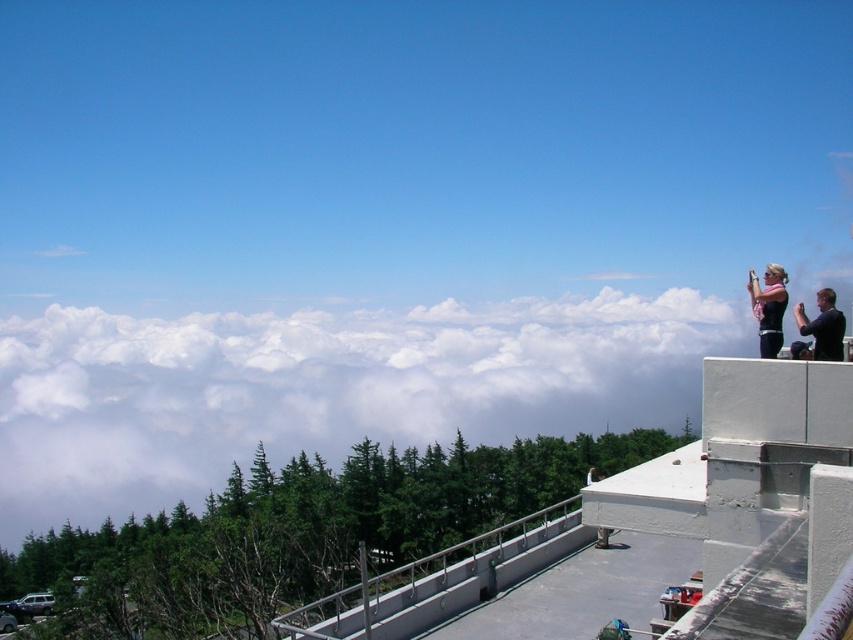
Question: Which is nearer to the pink fabric at upper right?

Choices:
 (A) white fluffy cloud at upper center
 (B) black matte shirt at upper right
 (C) satin silver railing at center
 (D) dark hair person at upper right

Answer: (B)

Question: Which of the following is the closest to the observer?

Choices:
 (A) (763, 310)
 (B) (67, 346)
 (C) (433, 625)
 (D) (596, 474)

Answer: (A)

Question: Is black matte shirt at upper right bigger than dark hair person at upper right?

Choices:
 (A) no
 (B) yes

Answer: (A)

Question: Does pink fabric at upper right appear under black matte shirt at upper right?

Choices:
 (A) no
 (B) yes

Answer: (A)

Question: Can you confirm if white fluffy cloud at upper center is smaller than satin silver railing at center?

Choices:
 (A) no
 (B) yes

Answer: (A)

Question: Which object is positioned farthest from the pink fabric at upper right?

Choices:
 (A) white fluffy cloud at upper center
 (B) satin silver railing at center

Answer: (A)